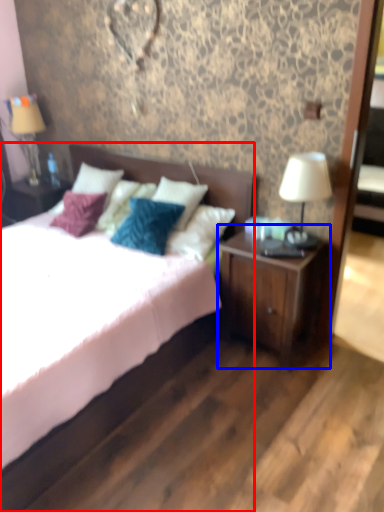
Question: Which point is further to the camera, bed (highlighted by a red box) or nightstand (highlighted by a blue box)?

Choices:
 (A) bed
 (B) nightstand

Answer: (B)